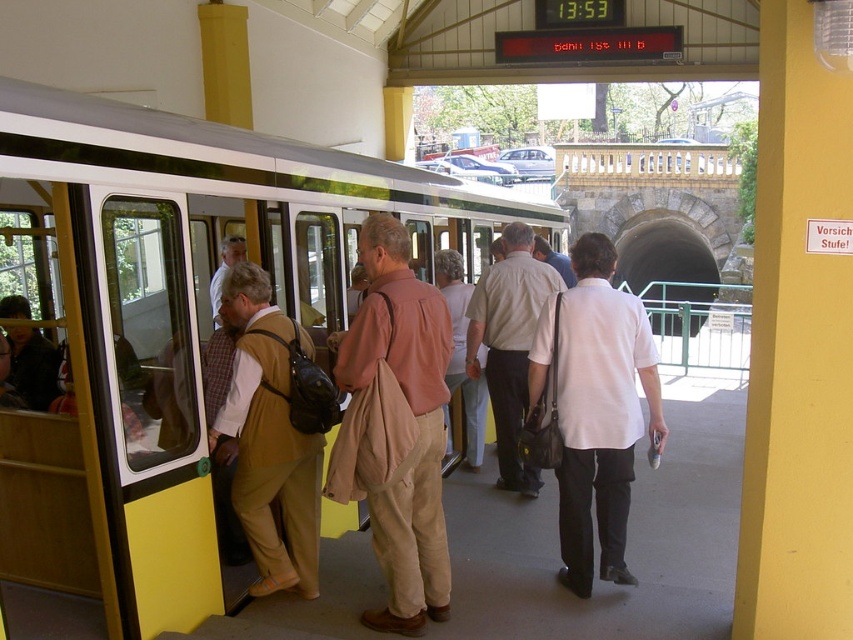
Is point (248, 518) behind point (529, 474)?

No.

Is khaki fabric vest at center in front of light beige fabric coat at center?

Yes.

Is point (291, 564) more distant than point (492, 285)?

No, it is in front of (492, 285).

What are the coordinates of `khaki fabric vest at center` in the screenshot? It's located at pyautogui.click(x=270, y=440).

From the picture: Is beige fabric bag at center wider than light beige fabric coat at center?

No, beige fabric bag at center is not wider than light beige fabric coat at center.

This screenshot has height=640, width=853. Describe the element at coordinates (416, 420) in the screenshot. I see `beige fabric bag at center` at that location.

Find the location of `beige fabric bag at center`. beige fabric bag at center is located at coordinates (416, 420).

Consider the image. Which is above, white smooth shirt at center or light beige fabric coat at center?

light beige fabric coat at center is above.

Is point (585, 401) positioned in front of point (505, 346)?

Yes.

This screenshot has width=853, height=640. I want to click on white smooth shirt at center, so click(x=595, y=408).